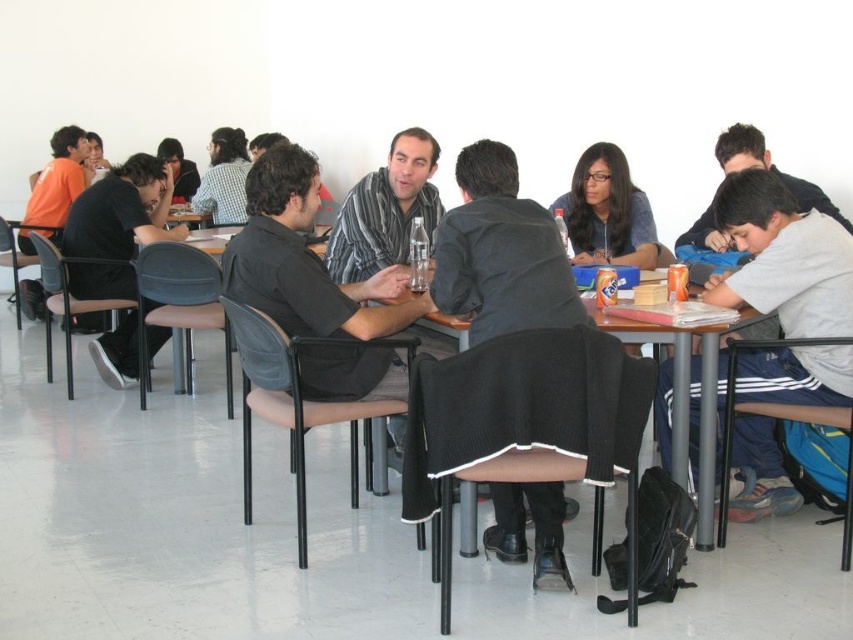
Who is lower down, gray cotton shirt at right or matte gray sweater at center?

gray cotton shirt at right is below.

Is gray cotton shirt at right behind matte gray sweater at center?

No, gray cotton shirt at right is closer to the viewer.

Which is in front, point (772, 358) or point (602, 253)?

Point (772, 358) is in front.

The height and width of the screenshot is (640, 853). Identify the location of gray cotton shirt at right. (782, 257).

Is black shirt at left shorter than matte gray sweater at center?

Incorrect, black shirt at left's height does not fall short of matte gray sweater at center's.

Does black shirt at left come behind matte gray sweater at center?

Yes, it is behind matte gray sweater at center.

Locate an element on the screen. black shirt at left is located at coordinates (117, 227).

Where is `black shirt at left`? black shirt at left is located at coordinates (117, 227).

Is matte gray sweater at center bigger than wooden table at center?

Incorrect, matte gray sweater at center is not larger than wooden table at center.

From the picture: Between matte gray sweater at center and wooden table at center, which one has less height?

matte gray sweater at center is shorter.

The image size is (853, 640). What do you see at coordinates (608, 212) in the screenshot?
I see `matte gray sweater at center` at bounding box center [608, 212].

You are a GUI agent. You are given a task and a screenshot of the screen. Output one action in this format:
    pyautogui.click(x=<x>, y=<y>)
    Task: Click on the matte gray sweater at center
    This screenshot has width=853, height=640.
    Given the screenshot: What is the action you would take?
    pyautogui.click(x=608, y=212)